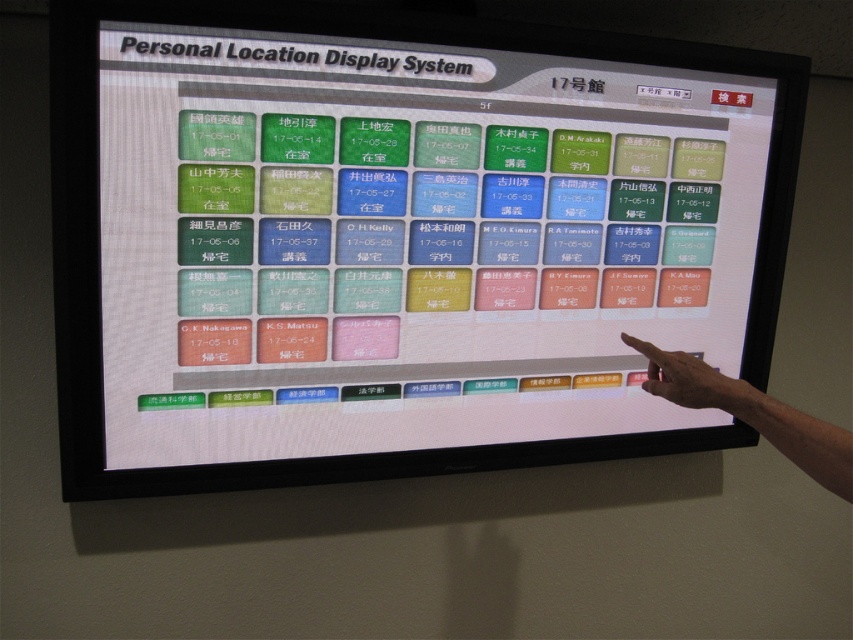
Question: Among these objects, which one is nearest to the camera?

Choices:
 (A) skin-toned flesh at lower right
 (B) white glossy monitor at center

Answer: (B)

Question: Is skin tone finger at upper right to the left of skin-toned flesh at lower right from the viewer's perspective?

Choices:
 (A) no
 (B) yes

Answer: (A)

Question: Can you confirm if white glossy monitor at center is thinner than skin-toned flesh at lower right?

Choices:
 (A) no
 (B) yes

Answer: (A)

Question: Which of these objects is positioned closest to the skin-toned flesh at lower right?

Choices:
 (A) skin tone finger at upper right
 (B) white glossy monitor at center

Answer: (A)

Question: Does white glossy monitor at center have a lesser width compared to skin-toned flesh at lower right?

Choices:
 (A) no
 (B) yes

Answer: (A)

Question: Which is nearer to the skin tone finger at upper right?

Choices:
 (A) white glossy monitor at center
 (B) skin-toned flesh at lower right

Answer: (B)